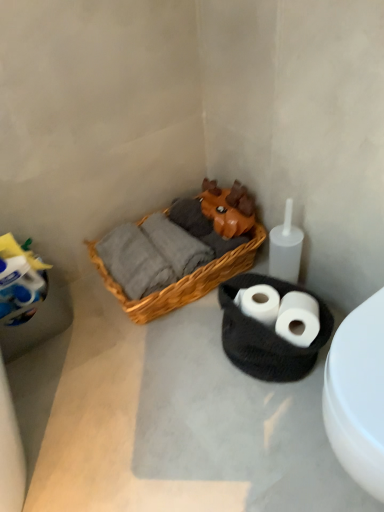
Where is `vacant space in front of woven wood picnic basket at center`? vacant space in front of woven wood picnic basket at center is located at coordinates (167, 380).